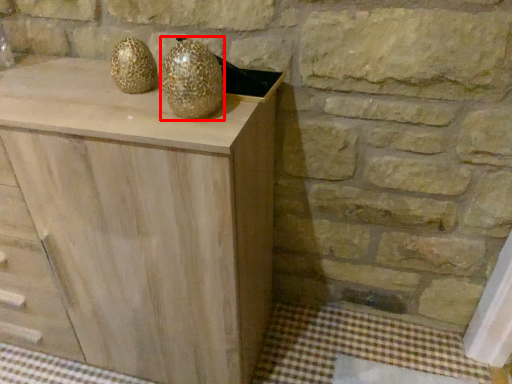
Question: Observing the image, what is the correct spatial positioning of glass vase (annotated by the red box) in reference to chest of drawers?

Choices:
 (A) right
 (B) left

Answer: (A)